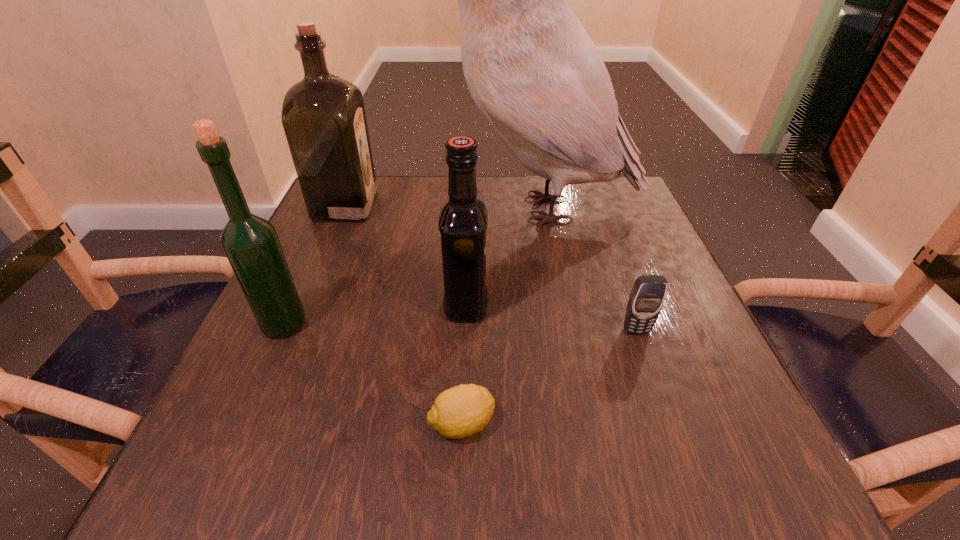
Image resolution: width=960 pixels, height=540 pixels. Identify the location of the tallest object. [x=536, y=76].

I want to click on the farthest liquor, so click(x=323, y=116).

At what (x,y) coordinates should I click in order to perform the action: click on the rightmost liquor. Please return your answer as a coordinate pair (x, y). The width and height of the screenshot is (960, 540). Looking at the image, I should click on (463, 219).

This screenshot has width=960, height=540. I want to click on the shortest liquor, so click(463, 219).

Where is `the second shortest object`? Image resolution: width=960 pixels, height=540 pixels. the second shortest object is located at coordinates (646, 299).

The height and width of the screenshot is (540, 960). I want to click on lemon, so click(x=462, y=410).

Image resolution: width=960 pixels, height=540 pixels. I want to click on the nearest object, so click(x=462, y=410).

Identify the location of free space located 0.270m on the face of the parakeet. Image resolution: width=960 pixels, height=540 pixels. (325, 210).

The width and height of the screenshot is (960, 540). I want to click on free space located on the face of the parakeet, so click(396, 210).

Locate an element on the screen. free point located 0.090m on the face of the parakeet is located at coordinates (400, 210).